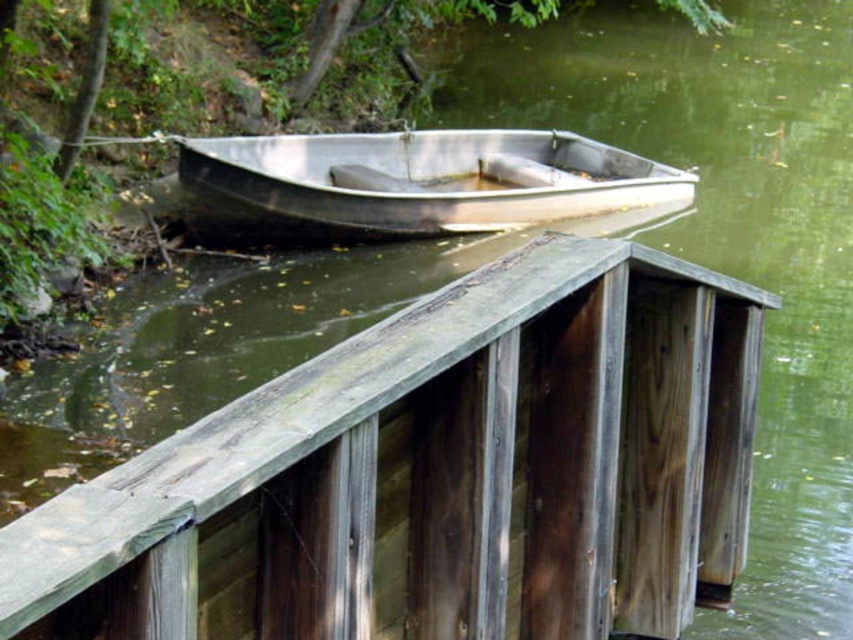
You are standing at the point with coordinates point (347, 140) and want to move towards the point with coordinates point (167, 620). According to the scene, will you be moving forward or backward?

Point (167, 620) is in front of point (347, 140), so moving towards it would mean moving forward.

You need to place a 1.5 meter long fishing rod horizontally on either the weathered wood rail at center or the metallic silver boat at center. Based on their widths, which surface can accommodate the rod without overhanging?

The metallic silver boat at center has a greater width than the weathered wood rail at center. Therefore, the metallic silver boat at center can accommodate the 1.5 meter long fishing rod without overhanging.